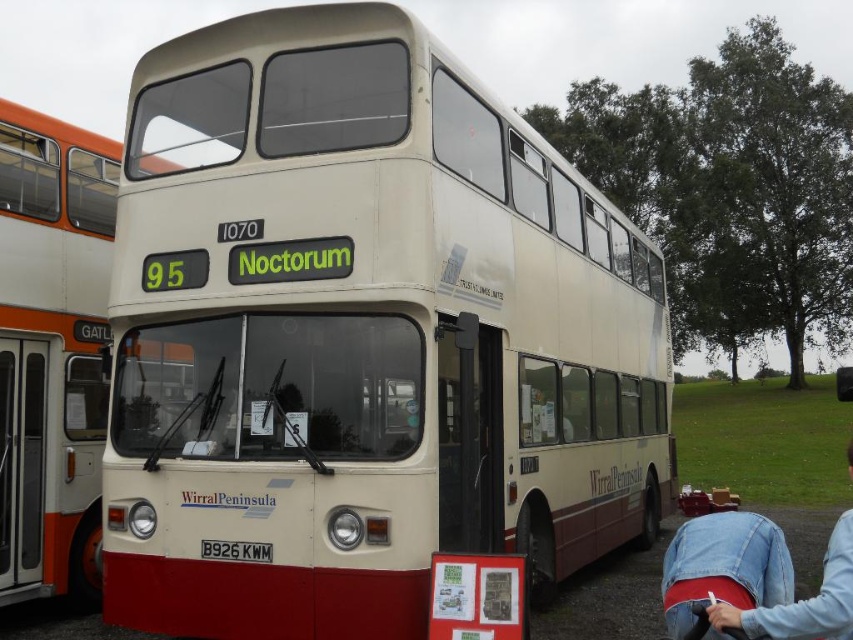
Is point (390, 253) closer to camera compared to point (796, 624)?

No, (390, 253) is behind (796, 624).

Does matte cream double-decker bus at center appear under denim jacket at lower right?

No.

The height and width of the screenshot is (640, 853). What do you see at coordinates (363, 337) in the screenshot?
I see `matte cream double-decker bus at center` at bounding box center [363, 337].

Identify the location of matte cream double-decker bus at center. The height and width of the screenshot is (640, 853). (363, 337).

Does matte cream double-decker bus at center have a greater height compared to white glossy bus at center?

No.

Consider the image. Can you confirm if matte cream double-decker bus at center is positioned below white glossy bus at center?

Actually, matte cream double-decker bus at center is above white glossy bus at center.

Is point (184, 358) positioned before point (20, 211)?

Yes, point (184, 358) is closer to viewer.

Locate an element on the screen. This screenshot has width=853, height=640. matte cream double-decker bus at center is located at coordinates (363, 337).

Is point (0, 401) more distant than point (686, 484)?

No, it is in front of (686, 484).

Is point (16, 241) positioned after point (695, 492)?

No, it is not.

Where is `white glossy bus at center`? This screenshot has height=640, width=853. white glossy bus at center is located at coordinates pyautogui.click(x=51, y=352).